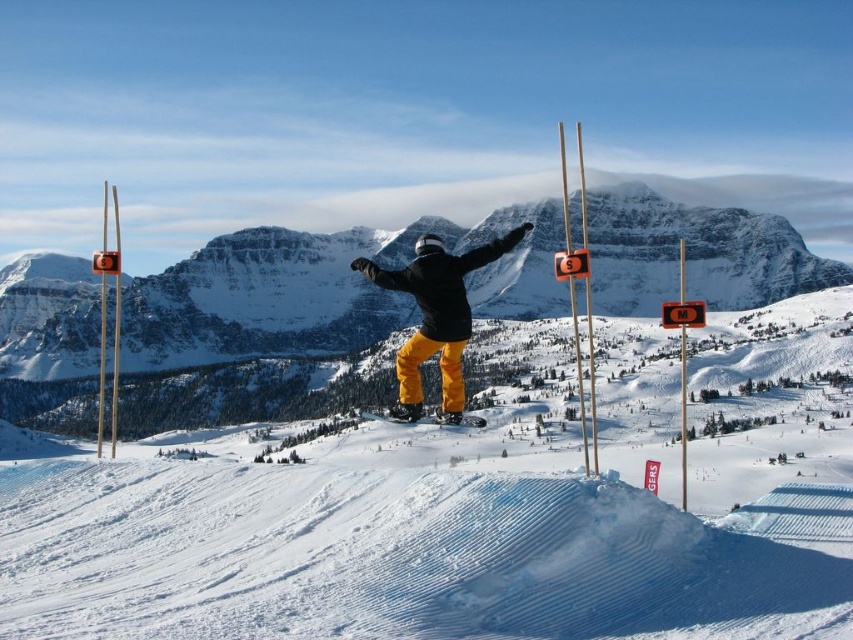
You are navigating a ski resort and need to locate two specific points marked on a map. The first point is at coordinates point (698, 564) and the second at point (474, 424). Based on the image provided, which point is closer to the snowboarder who is midair performing a jump?

Point (698, 564) is in front of point (474, 424), so the snowboarder is closer to point (698, 564).

You are a photographer trying to capture the snowboarder in midair. You notice the white powdery snow at center and the matte yellow snowboard at center. Which object is bigger in the photo?

The white powdery snow at center is larger in size than the matte yellow snowboard at center, so the white powdery snow at center will appear bigger in the photo.